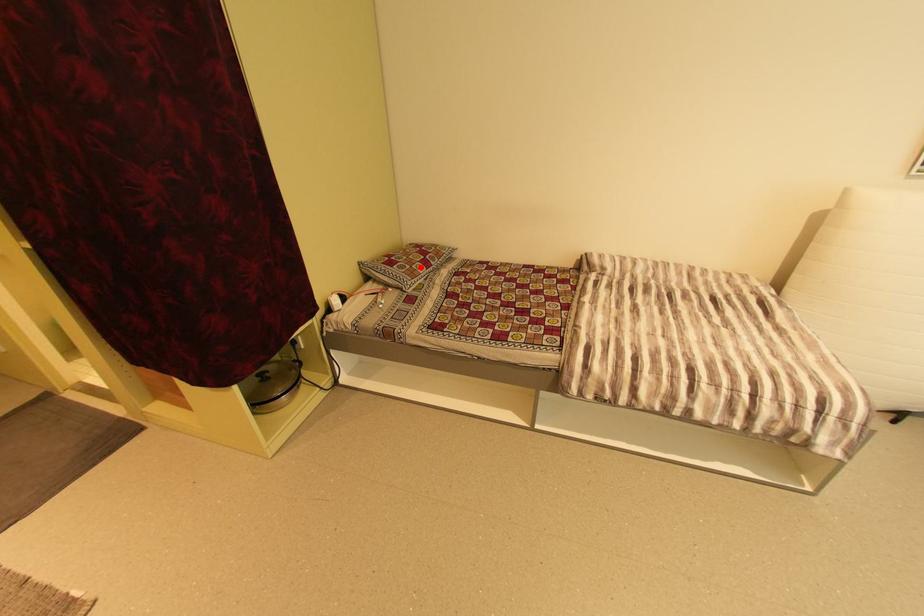
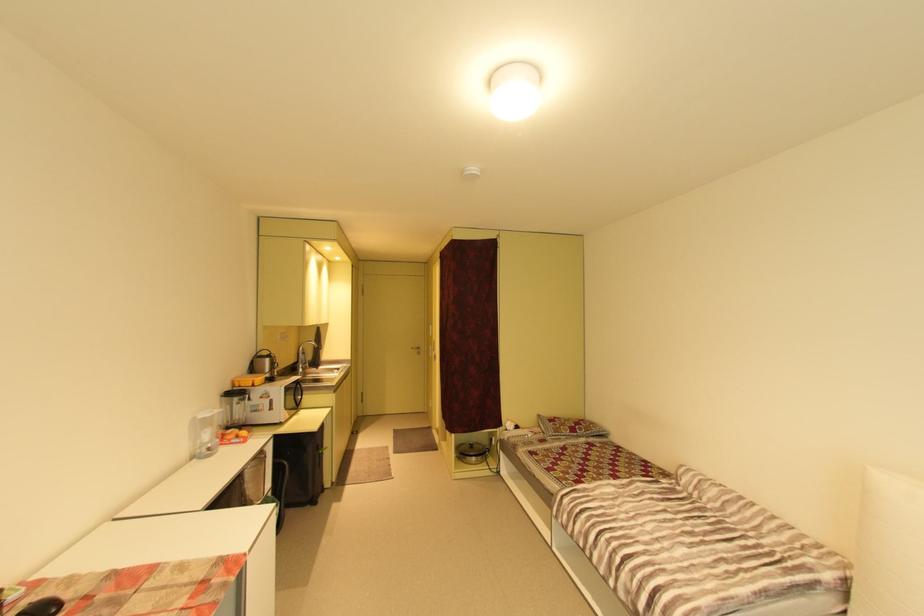
Question: I am providing you with two images of the same scene from different viewpoints. A red point is marked on the first image. Can you still see the location of the red point in image 2?

Choices:
 (A) Yes
 (B) No

Answer: (A)